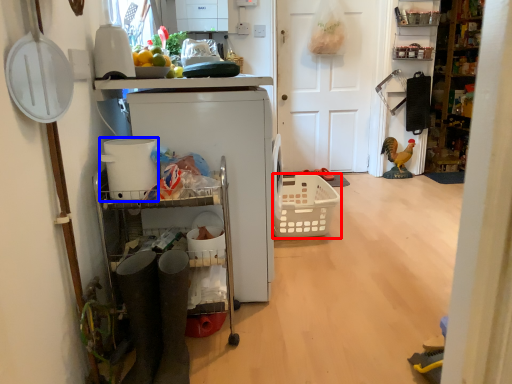
Question: Which object appears farthest to the camera in this image, basket (highlighted by a red box) or appliance (highlighted by a blue box)?

Choices:
 (A) basket
 (B) appliance

Answer: (A)